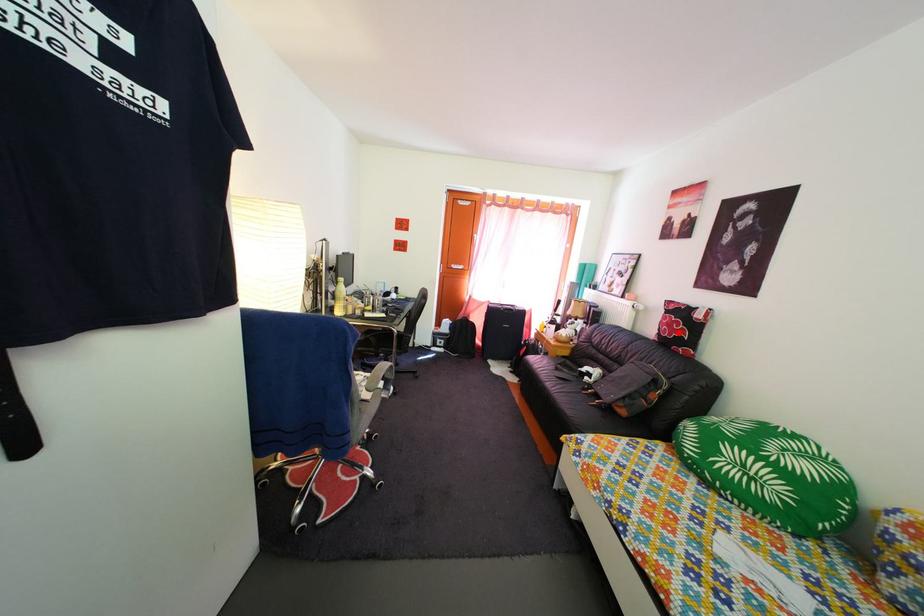
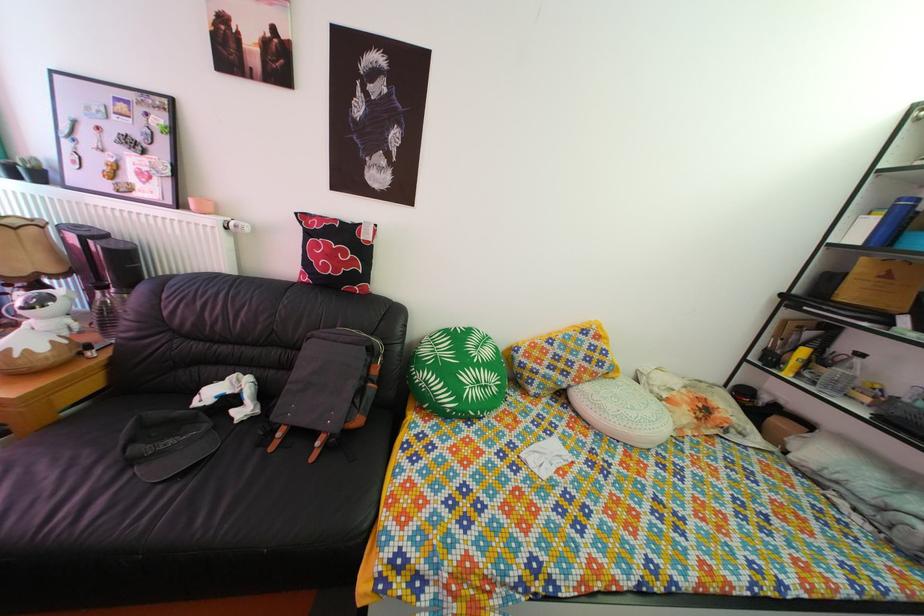
Where in the second image is the point corresponding to the highlighted location from the first image?

(338, 264)